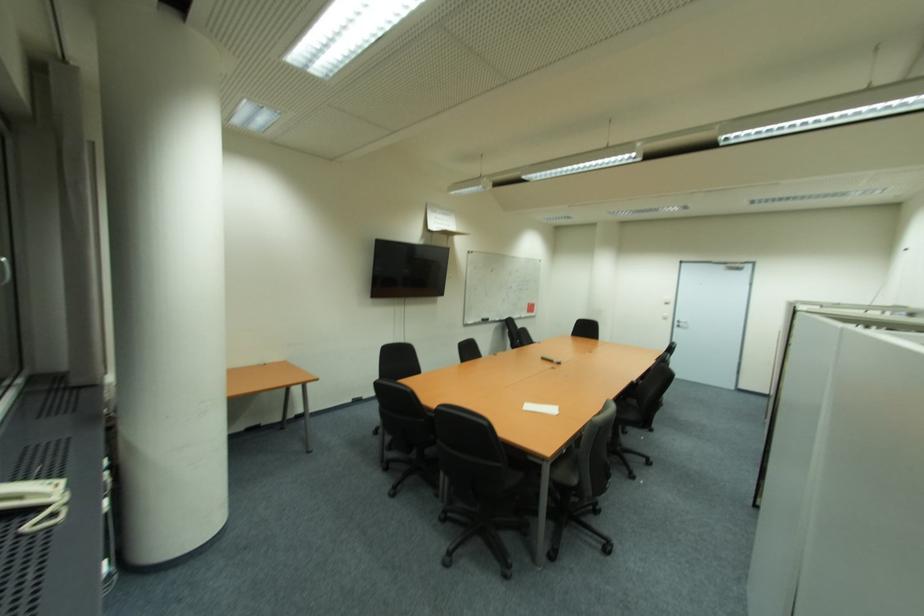
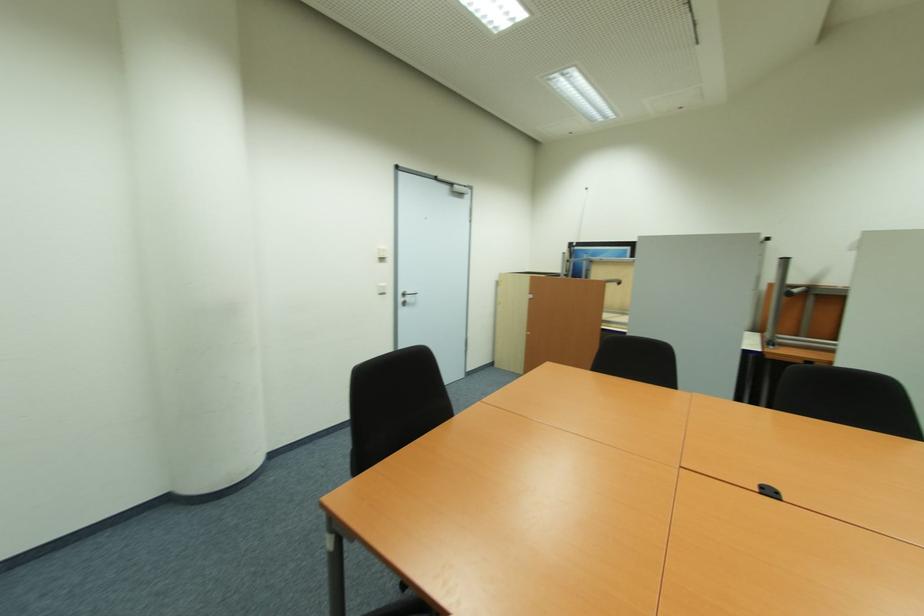
The point at (671,304) is marked in the first image. Where is the corresponding point in the second image?

(385, 260)